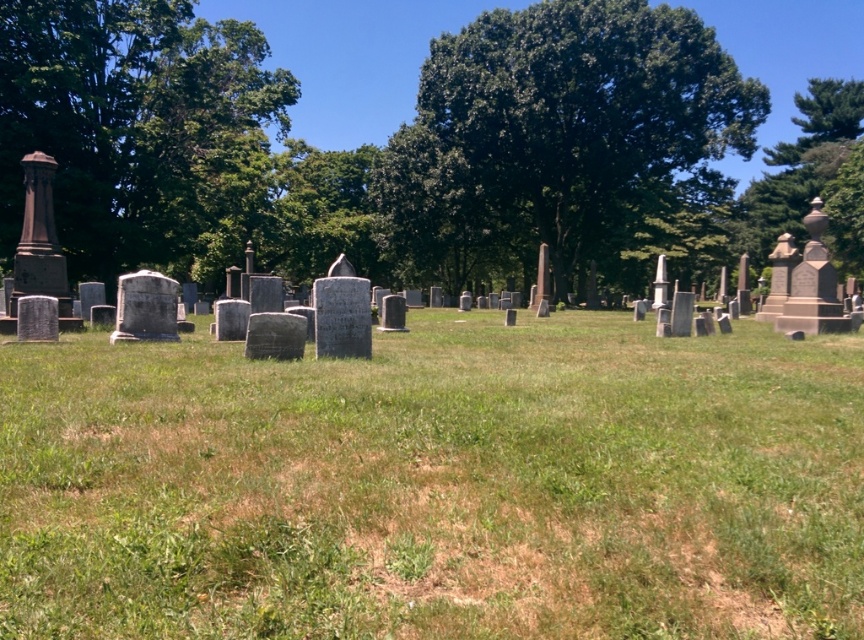
You are standing in the cemetery and want to take a photo of both the green leafy tree at center and the green leafy tree at upper right. Which tree should you position closer to the camera to include both in the frame without cropping?

To include both trees in the frame without cropping, position the green leafy tree at center closer to the camera since it is smaller than the green leafy tree at upper right.

You are standing in the cemetery and want to find a spot where you can see both the green leafy tree at center and the green leafy tree at upper right without any gravestones blocking your view. Is there such a spot available?

The green leafy tree at center is positioned under green leafy tree at upper right, so there might be an overlapping view between them. However, since gravestones are scattered in the middle ground, it depends on their placement. If the gravestones are not directly between you and the trees, you could find a spot where both trees are visible without obstruction.